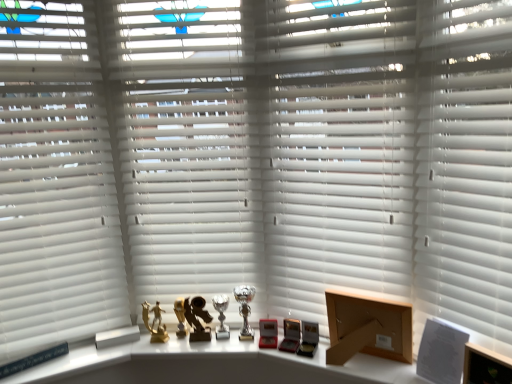
This screenshot has height=384, width=512. I want to click on vacant space in between white matte shutter at center, the third shutter viewed from the right, and white matte blinds at left, so click(143, 356).